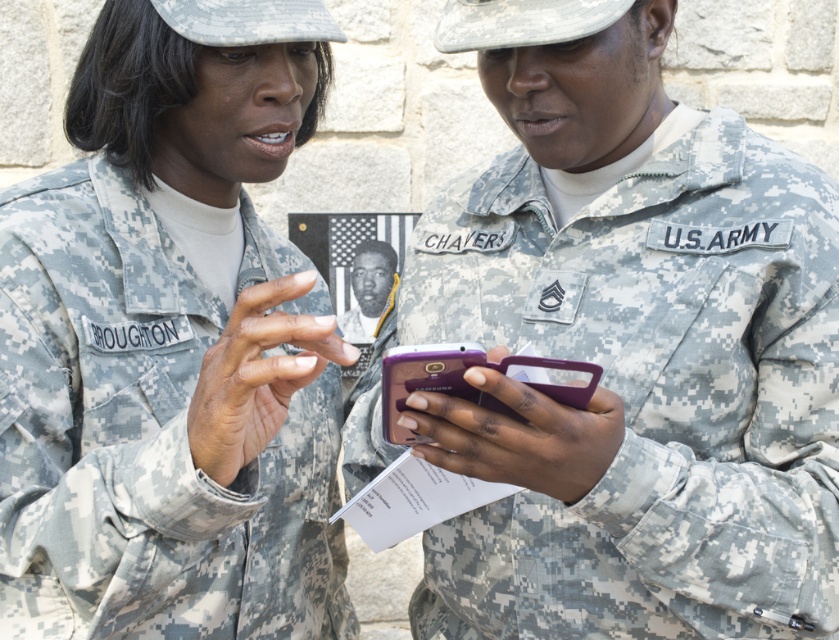
Question: Estimate the real-world distances between objects in this image. Which object is closer to the camouflage uniform at center?

Choices:
 (A) black matte photograph at center
 (B) camouflage fabric us army uniform at center

Answer: (B)

Question: Does camouflage fabric us army uniform at center appear over black matte photograph at center?

Choices:
 (A) no
 (B) yes

Answer: (A)

Question: Does camouflage uniform at center appear on the left side of black matte photograph at center?

Choices:
 (A) yes
 (B) no

Answer: (A)

Question: Among these points, which one is nearest to the camera?

Choices:
 (A) (154, 42)
 (B) (376, 296)

Answer: (A)

Question: Considering the real-world distances, which object is closest to the camouflage uniform at center?

Choices:
 (A) camouflage fabric us army uniform at center
 (B) black matte photograph at center

Answer: (A)

Question: Where is camouflage fabric us army uniform at center located in relation to black matte photograph at center in the image?

Choices:
 (A) right
 (B) left

Answer: (A)